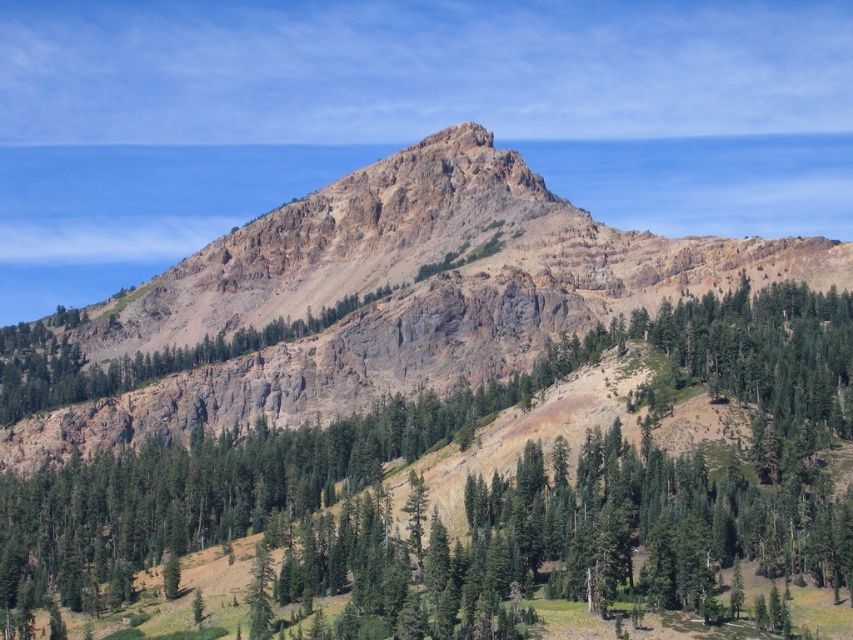
Which is above, green textured tree at upper center or rugged rock mountain at center?

rugged rock mountain at center is higher up.

Does green textured tree at upper center have a smaller size compared to rugged rock mountain at center?

Yes.

At what (x,y) coordinates should I click in order to perform the action: click on green textured tree at upper center. Please return your answer as a coordinate pair (x, y). This screenshot has height=640, width=853. Looking at the image, I should click on (672, 474).